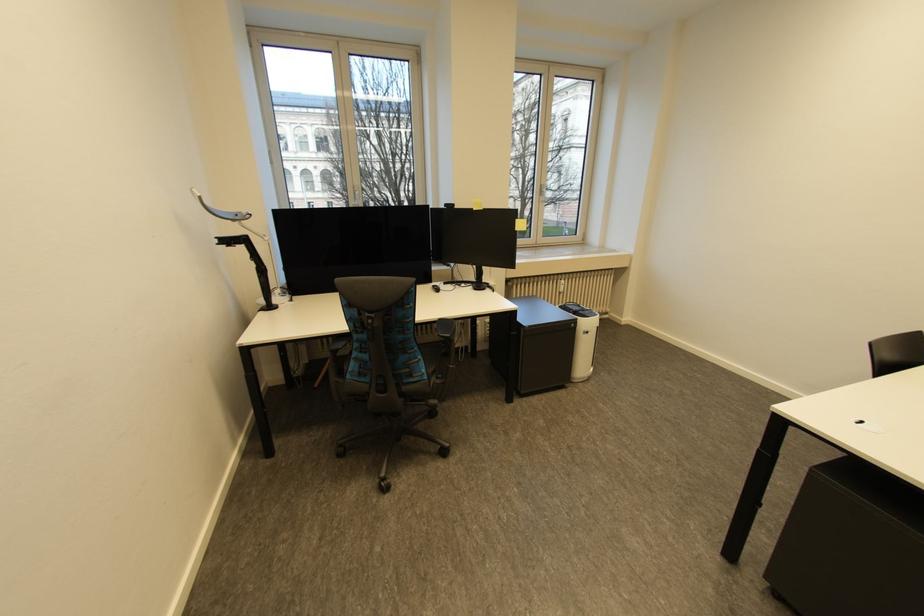
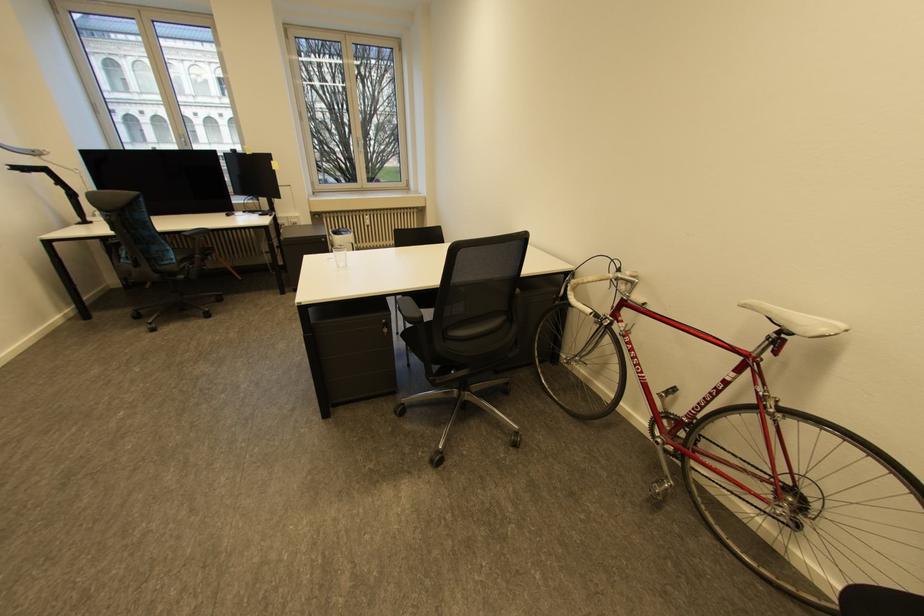
Where in the second image is the point corresponding to point (566, 294) from the first image?

(374, 227)